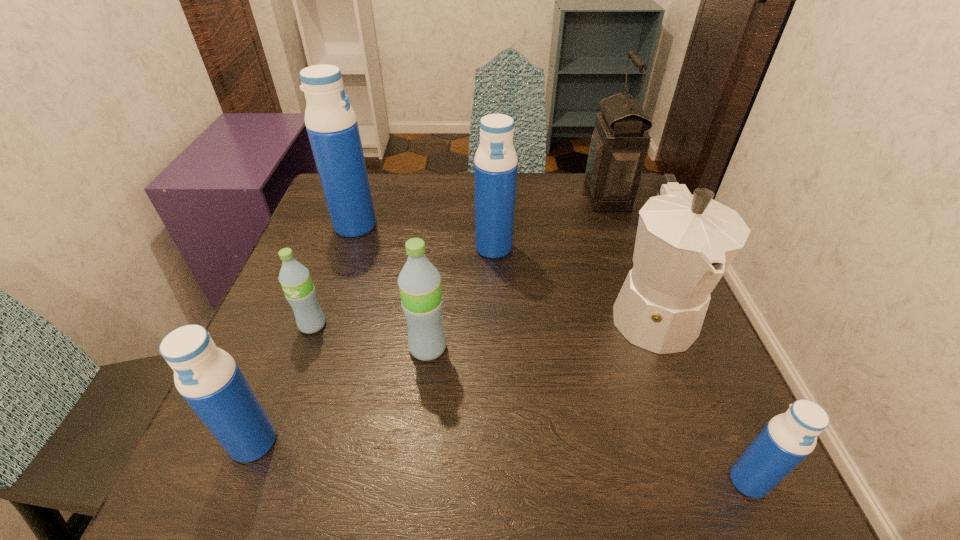
The image size is (960, 540). I want to click on the tallest water bottle, so click(331, 123).

At what (x,y) coordinates should I click in order to perform the action: click on the farthest object. Please return your answer as a coordinate pair (x, y). This screenshot has width=960, height=540. Looking at the image, I should click on (620, 142).

The height and width of the screenshot is (540, 960). What are the coordinates of `gray lantern` in the screenshot? It's located at (620, 142).

Locate an element on the screen. Image resolution: width=960 pixels, height=540 pixels. the third smallest blue water bottle is located at coordinates (495, 169).

Locate an element on the screen. This screenshot has width=960, height=540. the fifth shortest water bottle is located at coordinates (495, 169).

Find the location of a particular element. gray coffeepot is located at coordinates (684, 244).

Image resolution: width=960 pixels, height=540 pixels. In order to click on the fourth object from left to right in this screenshot , I will do `click(419, 281)`.

This screenshot has width=960, height=540. I want to click on the right green water bottle, so click(419, 281).

At what (x,y) coordinates should I click in order to perform the action: click on the second smallest blue water bottle. Please return your answer as a coordinate pair (x, y). Looking at the image, I should click on (207, 377).

Find the location of a particular element. The width and height of the screenshot is (960, 540). the smaller green water bottle is located at coordinates (299, 290).